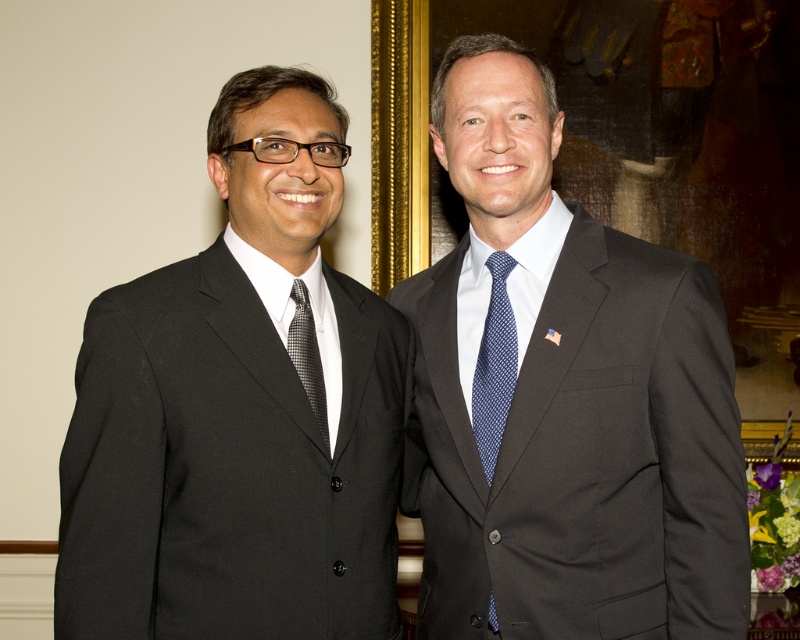
Question: Is matte black suit at right to the right of blue dotted tie at center from the viewer's perspective?

Choices:
 (A) yes
 (B) no

Answer: (A)

Question: Estimate the real-world distances between objects in this image. Which object is closer to the black textured tie at left?

Choices:
 (A) blue dotted tie at center
 (B) black matte suit at left
 (C) matte black suit at right

Answer: (B)

Question: Which point is closer to the camera taking this photo?

Choices:
 (A) (296, 280)
 (B) (729, 545)

Answer: (B)

Question: Which point is closer to the camera?

Choices:
 (A) (628, 531)
 (B) (114, 442)

Answer: (B)

Question: Can you confirm if matte black suit at right is positioned to the right of black matte suit at left?

Choices:
 (A) no
 (B) yes

Answer: (B)

Question: Is matte black suit at right positioned before blue dotted tie at center?

Choices:
 (A) yes
 (B) no

Answer: (A)